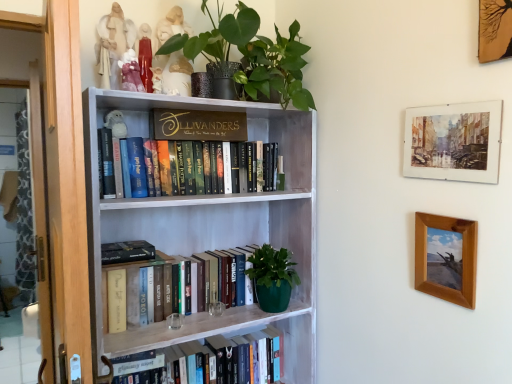
This screenshot has height=384, width=512. Identify the location of empty space that is ontop of gold metallic sign at upper center, which is counted as the first book, starting from the top (from a real-world perspective). (199, 111).